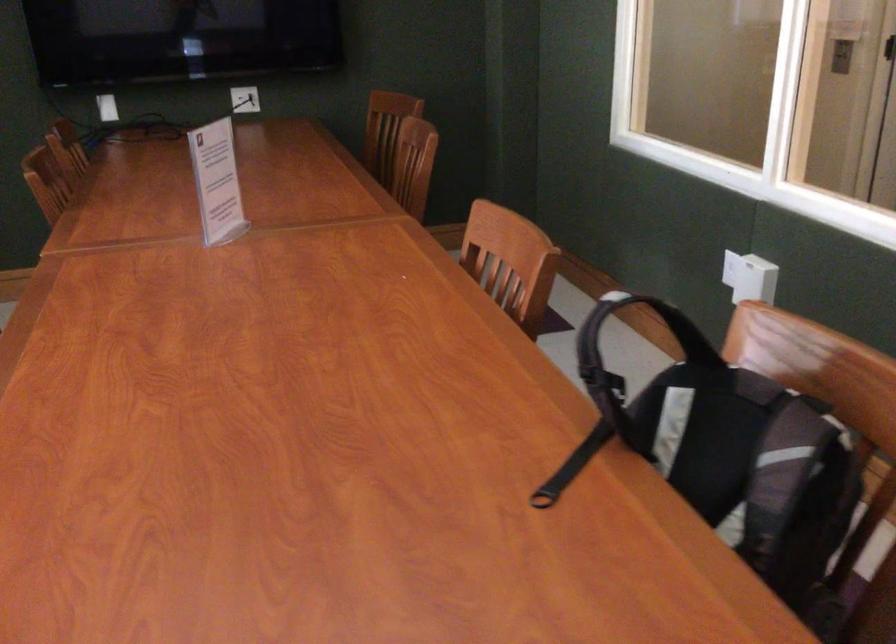
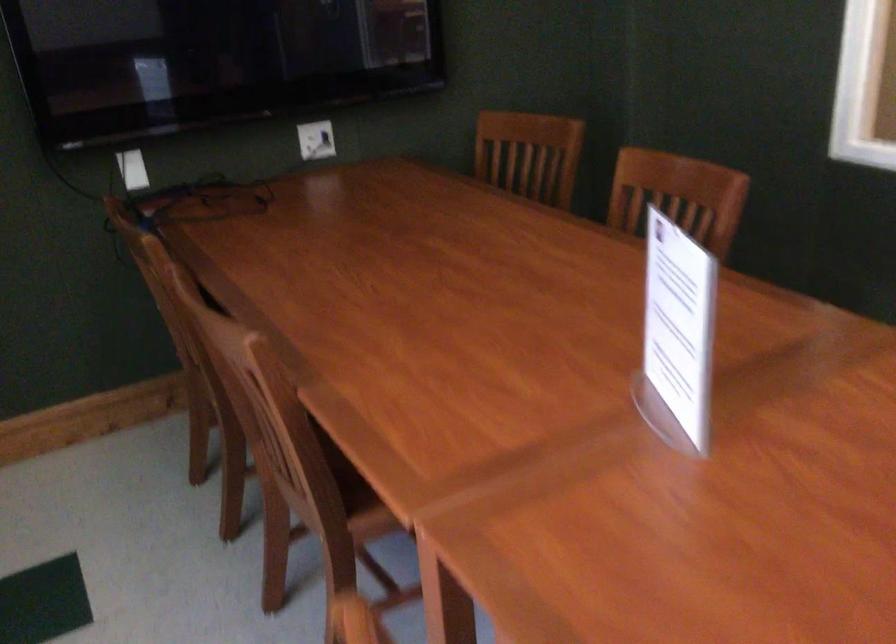
Locate, in the second image, the point that corresponds to point (71, 223) in the first image.

(299, 413)